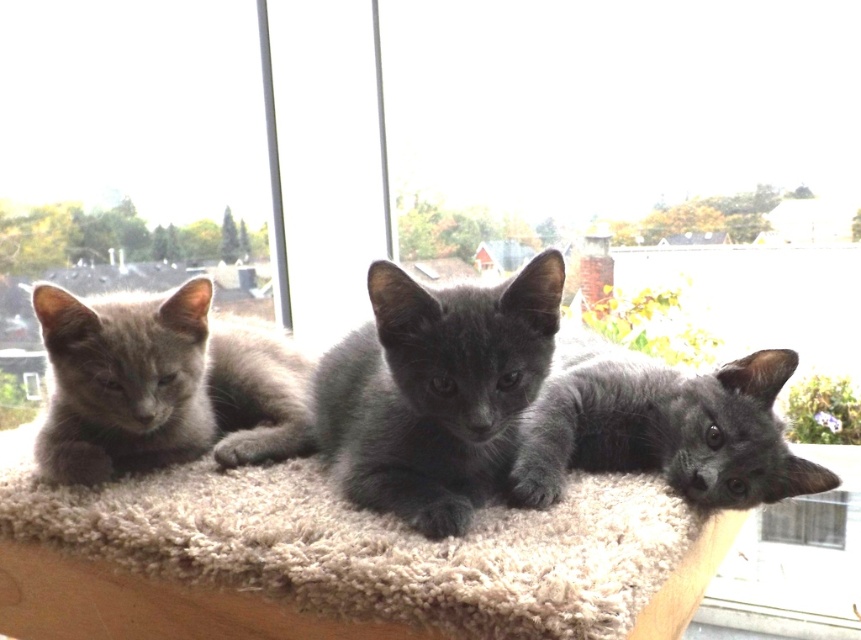
Question: Is shiny black kitten at center thinner than transparent glass window at lower right?

Choices:
 (A) yes
 (B) no

Answer: (A)

Question: Does shiny black kitten at center appear on the right side of transparent glass window at lower right?

Choices:
 (A) yes
 (B) no

Answer: (B)

Question: Which of the following is the farthest from the observer?

Choices:
 (A) shiny gray kitten at center
 (B) gray fluffy kitten at left
 (C) shiny black kitten at center

Answer: (B)

Question: Which point appears closest to the camera in this image?

Choices:
 (A) (201, 435)
 (B) (586, 353)
 (C) (648, 592)
 (D) (465, 416)

Answer: (C)

Question: Which object appears farthest from the camera in this image?

Choices:
 (A) shiny gray kitten at center
 (B) transparent glass window at lower right
 (C) shiny black kitten at center

Answer: (B)

Question: Can you confirm if soft beige carpet at center is smaller than shiny gray kitten at center?

Choices:
 (A) yes
 (B) no

Answer: (B)